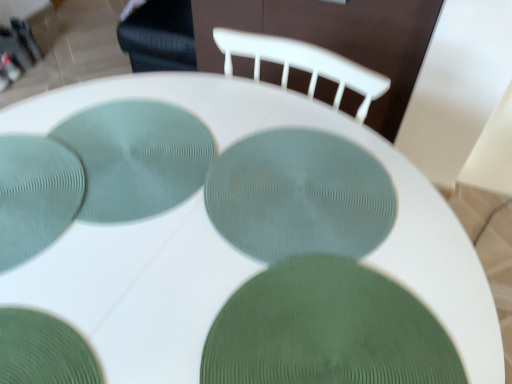
Identify the location of vacant space underneath matte green plate at lower left, marked as the 5th glass plate in a right-to-left arrangement (from a real-world perspective). This screenshot has width=512, height=384. (30, 195).